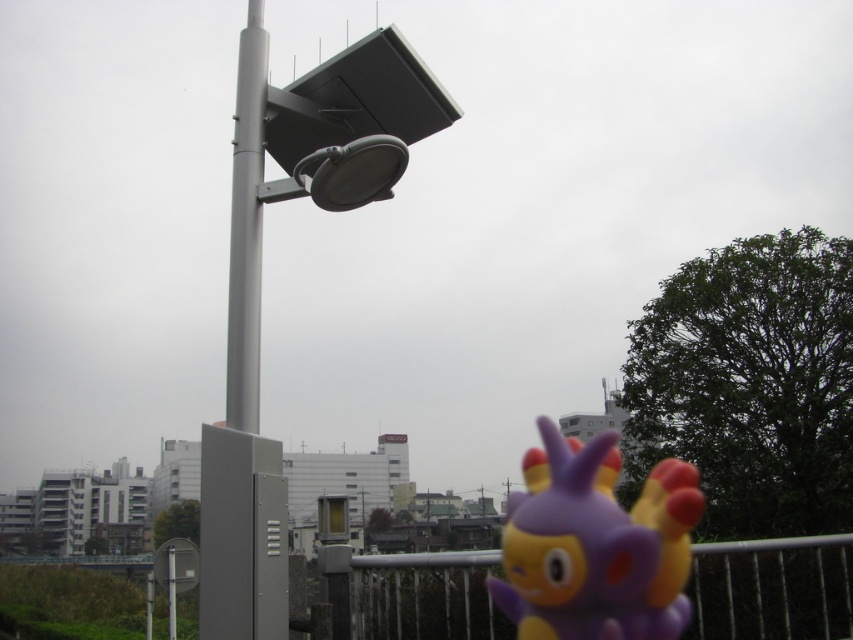
Who is lower down, white metal fence at lower center or gray metallic pole at center?

white metal fence at lower center

Is point (845, 580) closer to camera compared to point (248, 49)?

No, it is behind (248, 49).

Where is `white metal fence at lower center`? This screenshot has height=640, width=853. white metal fence at lower center is located at coordinates (772, 588).

Between point (677, 532) and point (827, 545), which one is positioned behind?

Point (827, 545)

Who is shorter, purple rubber toy at lower right or white metal fence at lower center?

With less height is white metal fence at lower center.

Who is more distant from viewer, [685,572] or [442,588]?

The point [685,572] is behind.

This screenshot has width=853, height=640. I want to click on purple rubber toy at lower right, so click(x=595, y=545).

Is purple rubber toy at lower right bigger than gray metallic pole at center?

Indeed, purple rubber toy at lower right has a larger size compared to gray metallic pole at center.

Is point (543, 637) farther from viewer compared to point (244, 120)?

Yes.

At what (x,y) coordinates should I click in order to perform the action: click on purple rubber toy at lower right. Please return your answer as a coordinate pair (x, y). Looking at the image, I should click on (595, 545).

Locate an element on the screen. The image size is (853, 640). purple rubber toy at lower right is located at coordinates (595, 545).